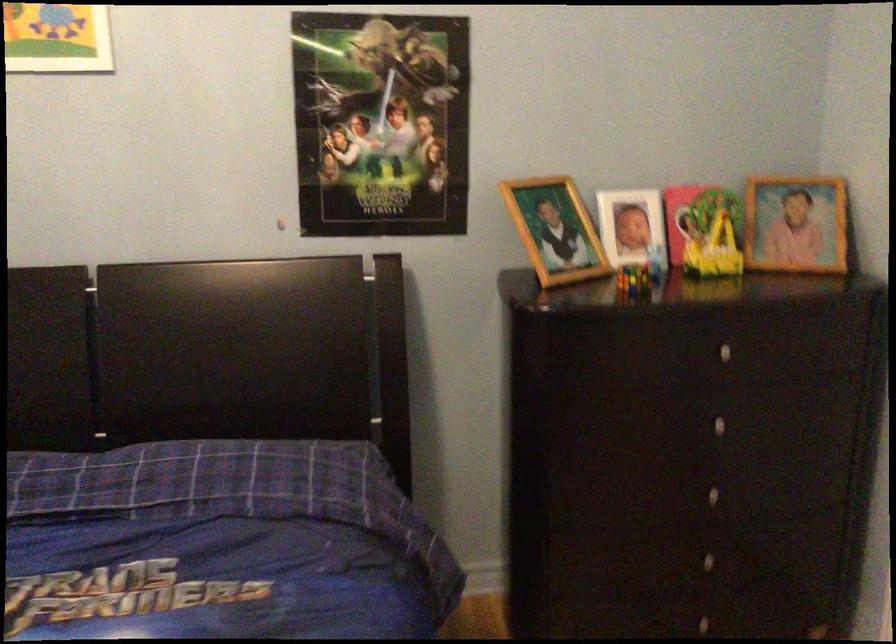
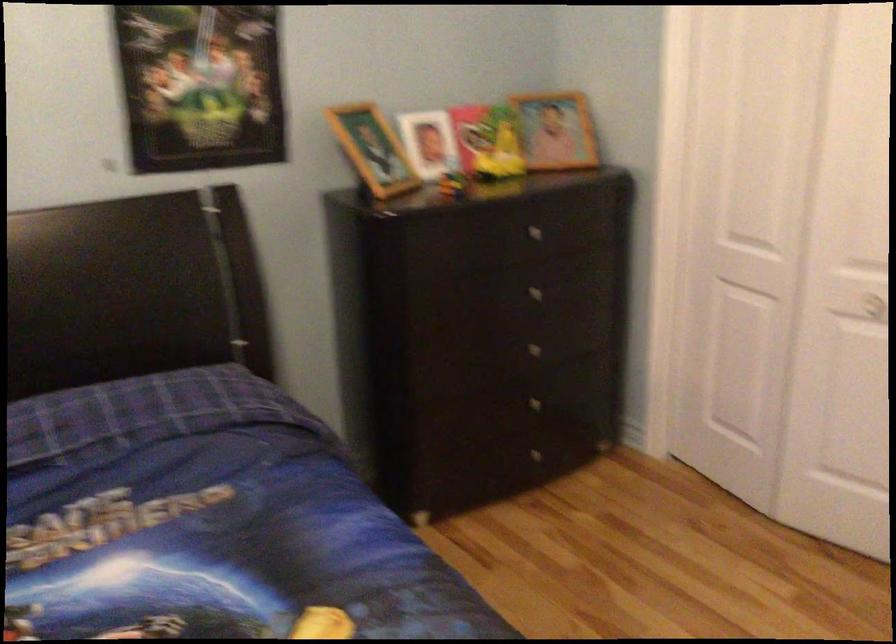
Where in the second image is the point corresponding to point (694, 560) from the first image?

(528, 406)